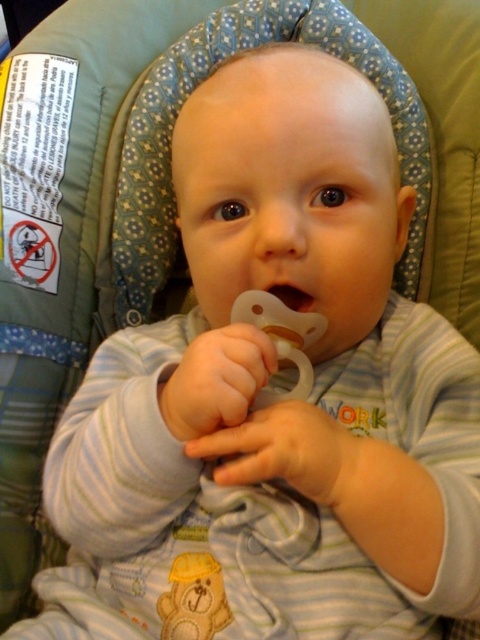
In the scene shown: You are a safety inspector checking the car seat for potential hazards. You notice the yellow fabric teddy bear at center and the clear plastic pacifier at center. According to safety guidelines, which object should not be placed in front of the other?

The yellow fabric teddy bear at center should not be placed in front of the clear plastic pacifier at center because it is blocking the pacifier, which could be a safety hazard if it obstructs the baby from accessing it properly.

You are a parent trying to decide which item to hand to your baby first. The yellow fabric teddy bear at center and the clear plastic pacifier at center are both within reach. Based on their sizes, which item should you pick up first to ensure it fits comfortably in the baby?

The yellow fabric teddy bear at center is bigger than the clear plastic pacifier at center, so you should pick up the clear plastic pacifier at center first since it is smaller and easier for the baby to handle comfortably.

You are a parent checking the baby seat for safety. You notice the yellow fabric teddy bear at center and the clear plastic pacifier at center. Which object is positioned to the left side of the other?

The yellow fabric teddy bear at center is to the left of the clear plastic pacifier at center, so the teddy bear is positioned to the left of the pacifier.